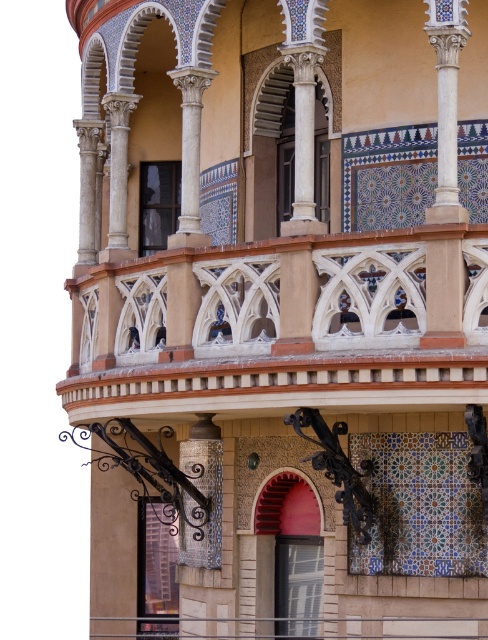
Can you confirm if clear glass window at center is thinner than matte glass window at center?

Yes, clear glass window at center is thinner than matte glass window at center.

Between point (308, 586) and point (159, 180), which one is positioned in front?

Point (308, 586) is more forward.

Which is in front, point (309, 630) or point (155, 204)?

Positioned in front is point (309, 630).

At what (x,y) coordinates should I click in order to perform the action: click on clear glass window at center. Please return your answer as a coordinate pair (x, y). Looking at the image, I should click on (x=298, y=582).

Which is behind, point (143, 525) or point (299, 576)?

Point (143, 525)

Can you confirm if matte glass window at lower center is smaller than clear glass window at center?

Correct, matte glass window at lower center occupies less space than clear glass window at center.

Identify the location of matte glass window at lower center. (156, 570).

How distant is white stone balcony at center from matte glass window at center?

white stone balcony at center is 40.12 feet from matte glass window at center.

Which is more to the right, white stone balcony at center or matte glass window at center?

white stone balcony at center

The image size is (488, 640). In order to click on white stone balcony at center in this screenshot , I will do `click(286, 326)`.

Find the location of a particular element. white stone balcony at center is located at coordinates (286, 326).